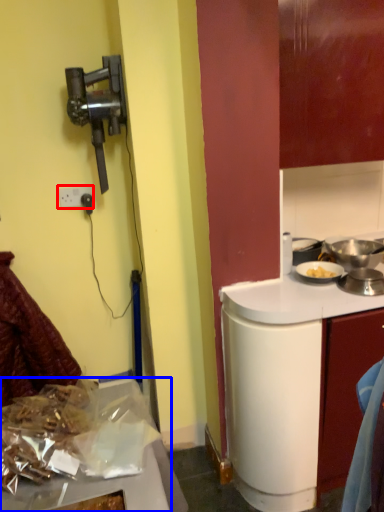
Question: Which point is closer to the camera, power outlet (highlighted by a red box) or kitchen appliance (highlighted by a blue box)?

Choices:
 (A) power outlet
 (B) kitchen appliance

Answer: (B)